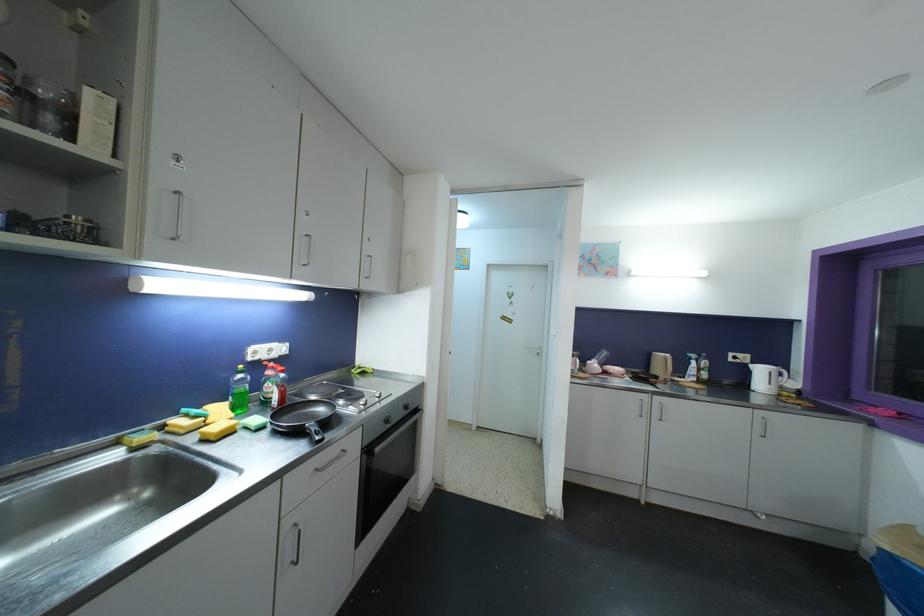
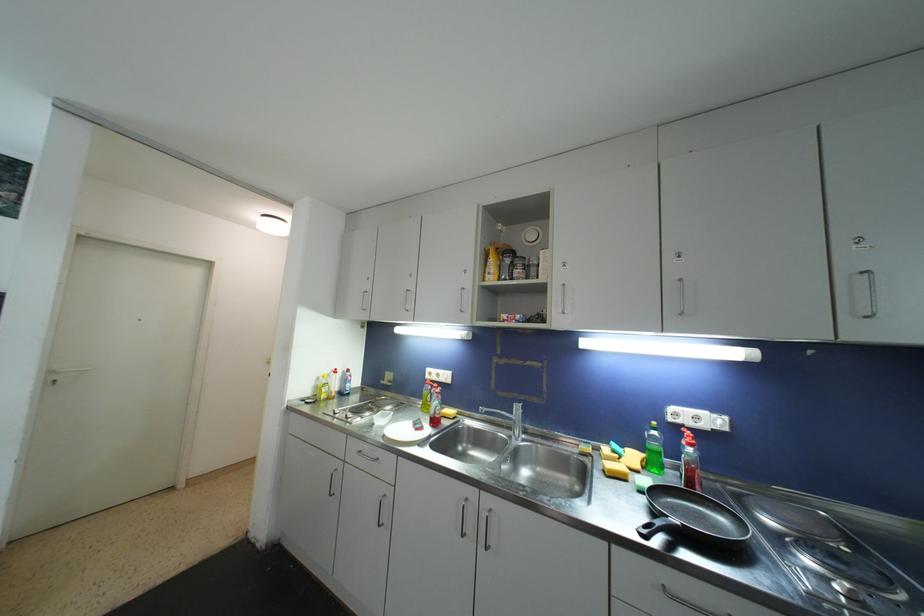
Question: The images are taken continuously from a first-person perspective. In which direction is your viewpoint rotating?

Choices:
 (A) Left
 (B) Right
 (C) Up
 (D) Down

Answer: (A)